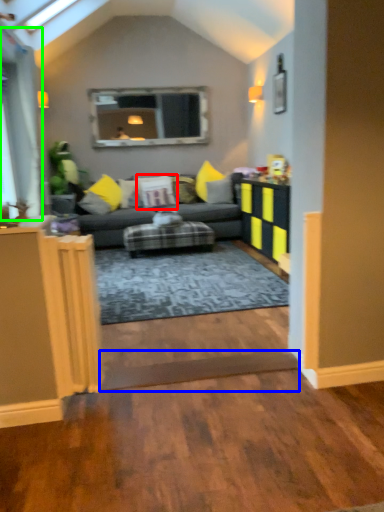
Question: Based on their relative distances, which object is nearer to pillow (highlighted by a red box)? Choose from plank (highlighted by a blue box) and glass door (highlighted by a green box).

Choices:
 (A) plank
 (B) glass door

Answer: (B)